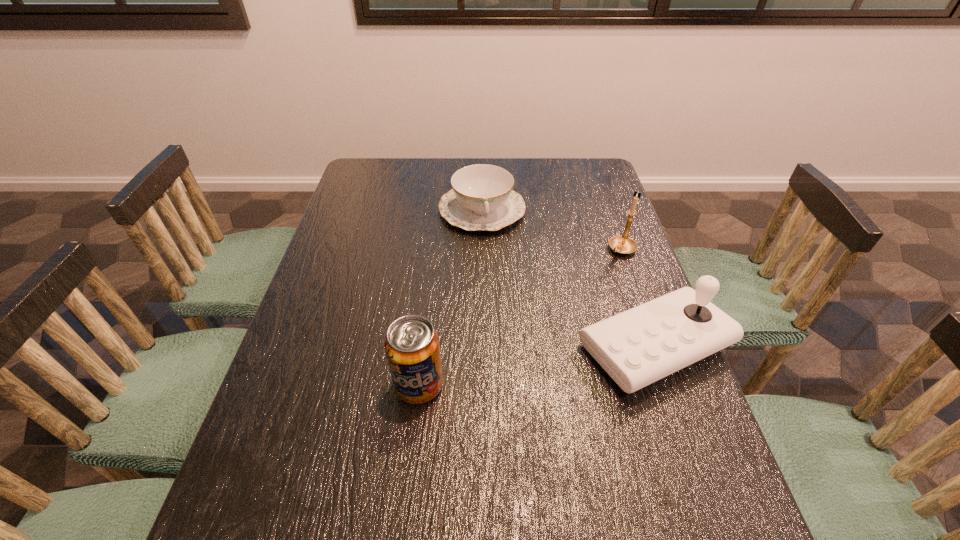
The image size is (960, 540). Find the location of `blank region between the soda can and the second farthest object`. blank region between the soda can and the second farthest object is located at coordinates (520, 317).

The image size is (960, 540). Find the location of `free space between the candle holder and the joystick`. free space between the candle holder and the joystick is located at coordinates (638, 298).

Find the location of a particular element. The image size is (960, 540). object that can be found as the second closest to the second farthest object is located at coordinates tap(482, 198).

Point out which object is positioned as the second nearest to the farthest object. Please provide its 2D coordinates. Your answer should be formatted as a tuple, i.e. [(x, y)], where the tuple contains the x and y coordinates of a point satisfying the conditions above.

[(637, 347)]

At what (x,y) coordinates should I click in order to perform the action: click on free space that satisfies the following two spatial constraints: 1. on the back side of the third nearest object; 2. on the right side of the soda can. Please return your answer as a coordinate pair (x, y). Looking at the image, I should click on (435, 249).